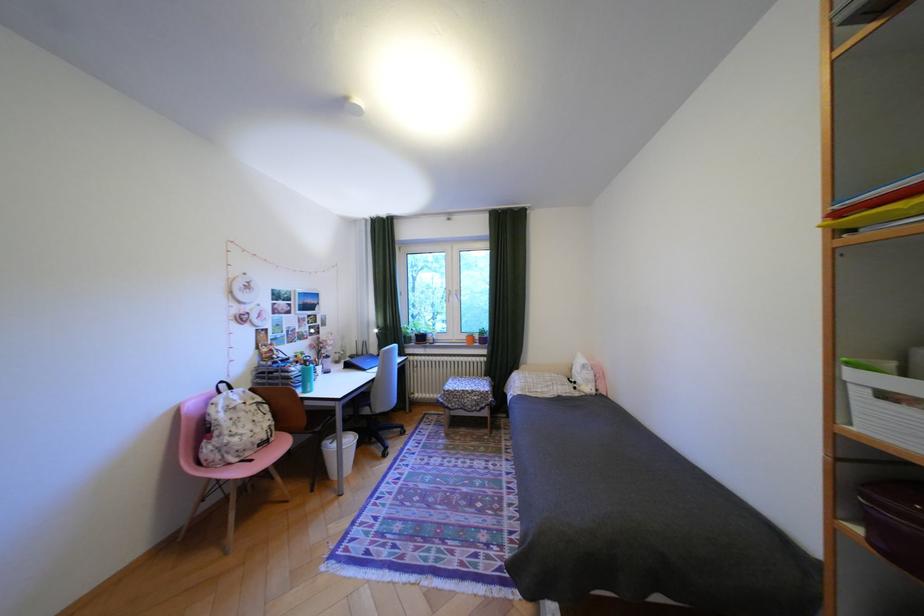
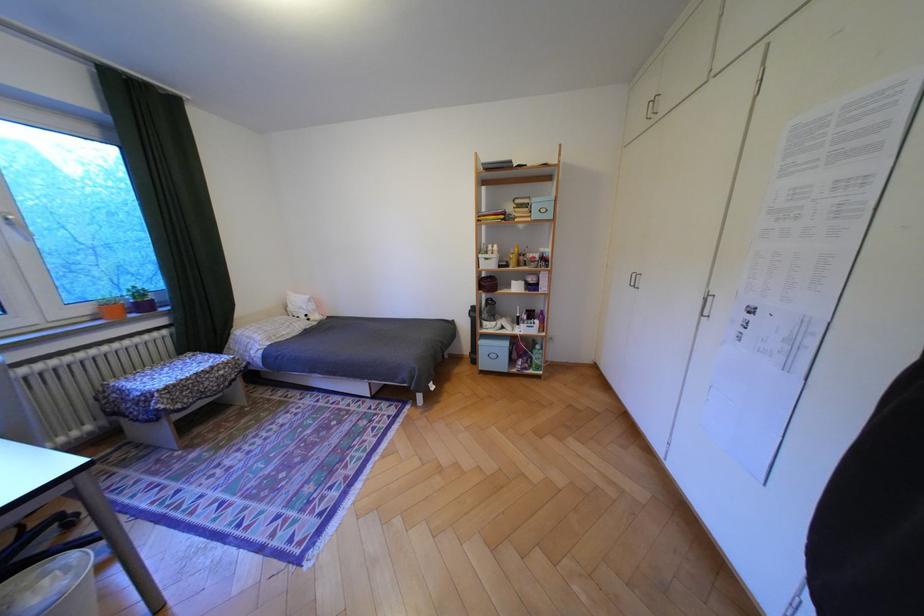
Locate, in the second image, the point that corresponds to point (476, 337) in the first image.

(99, 310)